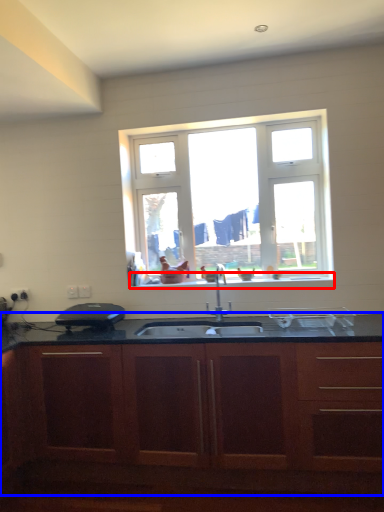
Question: Among these objects, which one is farthest to the camera, window sill (highlighted by a red box) or cabinetry (highlighted by a blue box)?

Choices:
 (A) window sill
 (B) cabinetry

Answer: (A)